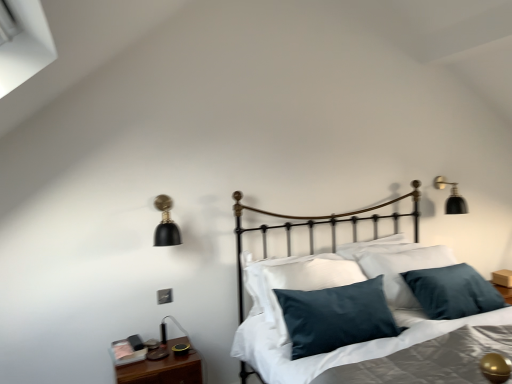
Question: Is wooden nightstand at lower left far from velvety dark blue pillow at center, which ranks as the second pillow in front-to-back order?

Choices:
 (A) yes
 (B) no

Answer: (B)

Question: Is wooden nightstand at lower left closer to camera compared to velvety dark blue pillow at center, which ranks as the second pillow in front-to-back order?

Choices:
 (A) no
 (B) yes

Answer: (B)

Question: Is wooden nightstand at lower left at the right side of velvety dark blue pillow at center, which appears as the first pillow when viewed from the back?

Choices:
 (A) yes
 (B) no

Answer: (B)

Question: Is wooden nightstand at lower left not within velvety dark blue pillow at center, which appears as the first pillow when viewed from the back?

Choices:
 (A) no
 (B) yes

Answer: (B)

Question: Can you confirm if wooden nightstand at lower left is shorter than velvety dark blue pillow at center, which appears as the first pillow when viewed from the back?

Choices:
 (A) no
 (B) yes

Answer: (B)

Question: Visually, is velvety dark blue pillow at center, which ranks as the second pillow in front-to-back order, positioned to the left or to the right of wooden nightstand at lower left?

Choices:
 (A) left
 (B) right

Answer: (B)

Question: Is velvety dark blue pillow at center, which ranks as the second pillow in front-to-back order, in front of or behind wooden nightstand at lower left in the image?

Choices:
 (A) front
 (B) behind

Answer: (B)

Question: From a real-world perspective, is velvety dark blue pillow at center, which ranks as the second pillow in front-to-back order, physically located above or below wooden nightstand at lower left?

Choices:
 (A) below
 (B) above

Answer: (B)

Question: Is point (273, 306) closer or farther from the camera than point (173, 354)?

Choices:
 (A) closer
 (B) farther

Answer: (A)

Question: From their relative heights in the image, would you say black matte lamp at left, the first lamp in the left-to-right sequence, is taller or shorter than silky gray sheet at center?

Choices:
 (A) tall
 (B) short

Answer: (B)

Question: Considering the positions of point (158, 198) and point (495, 319), is point (158, 198) closer or farther from the camera than point (495, 319)?

Choices:
 (A) farther
 (B) closer

Answer: (A)

Question: In the image, is black matte lamp at left, placed as the second lamp when sorted from right to left, positioned in front of or behind silky gray sheet at center?

Choices:
 (A) behind
 (B) front

Answer: (A)

Question: From a real-world perspective, relative to silky gray sheet at center, is black matte lamp at left, placed as the second lamp when sorted from right to left, vertically above or below?

Choices:
 (A) above
 (B) below

Answer: (A)

Question: From a real-world perspective, relative to wooden nightstand at lower left, is silky gray sheet at center vertically above or below?

Choices:
 (A) above
 (B) below

Answer: (A)

Question: Relative to wooden nightstand at lower left, is silky gray sheet at center in front or behind?

Choices:
 (A) front
 (B) behind

Answer: (A)